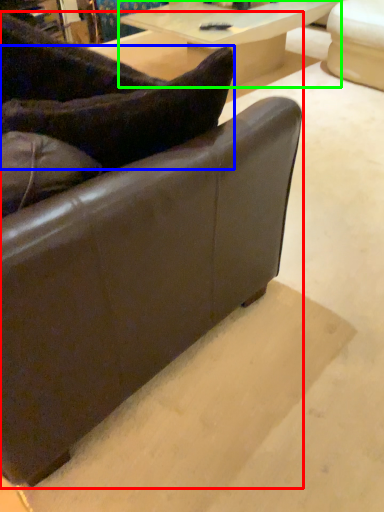
Question: Based on their relative distances, which object is nearer to studio couch (highlighted by a red box)? Choose from pillow (highlighted by a blue box) and table (highlighted by a green box).

Choices:
 (A) pillow
 (B) table

Answer: (A)